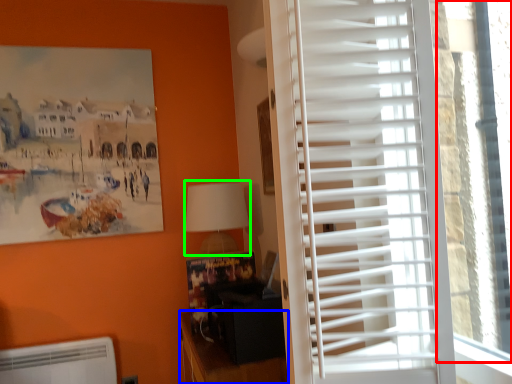
Question: Which object is positioned farthest from window screen (highlighted by a red box)? Select from furniture (highlighted by a blue box) and table lamp (highlighted by a green box).

Choices:
 (A) furniture
 (B) table lamp

Answer: (B)